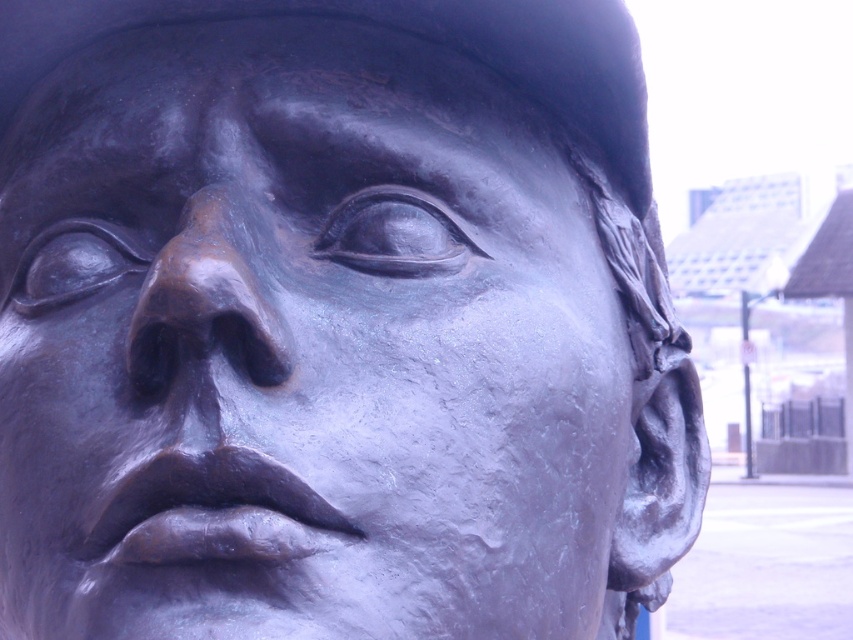
You are standing in front of the bronze statue and want to take a photo of the sculpture. The camera you are using has a focal length of 50mm and a sensor size of 24mm x 36mm. If the point at coordinates (300, 348) marks the center of the bronze sculpture, what is the minimum distance you should maintain from the statue to ensure the entire sculpture fits within the camera sensor?

The point at coordinates (300, 348) marks the center of the bronze sculpture. To ensure the entire sculpture fits within the camera sensor, you need to calculate the minimum distance based on the sensor dimensions and focal length. However, without knowing the actual size of the sculpture, it is impossible to determine the exact distance required. Please provide the sculpture dimensions for an accurate calculation.

You are standing in front of the bronze statue and want to take a photo of the point at coordinates point (469, 282). If your camera can focus on objects within 3 feet, will it be able to capture the point clearly?

The distance of point (469, 282) from camera is 3.68 feet, which is beyond the camera focus range of 3 feet. The camera cannot capture the point clearly.

You are an art student analyzing the sculpture. You notice two elements in the image. The first is the bronze sculpture at center, and the second is the bronze textured nose at center. Which of these two elements is bigger in size?

The bronze sculpture at center is larger in size than the bronze textured nose at center.